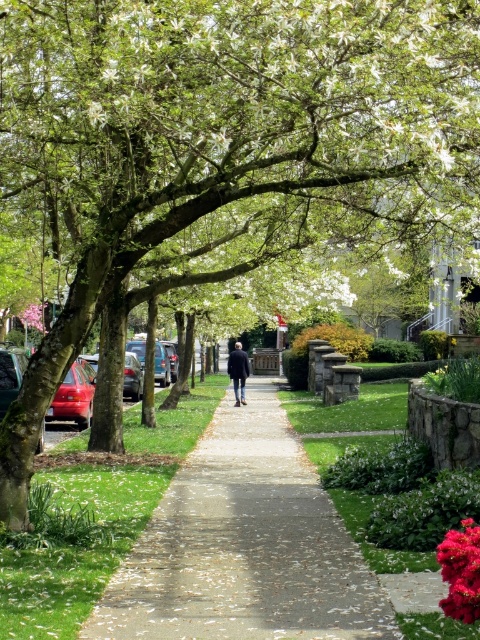
Is vivid crimson petals at center right above shiny red car at left?

No, vivid crimson petals at center right is not above shiny red car at left.

Which is above, vivid crimson petals at center right or shiny red car at left?

Positioned higher is shiny red car at left.

Between point (446, 534) and point (48, 413), which one is positioned in front?

Positioned in front is point (446, 534).

Locate an element on the screen. The width and height of the screenshot is (480, 640). vivid crimson petals at center right is located at coordinates (460, 572).

How much distance is there between concrete sidewalk at center and shiny red car at left?

concrete sidewalk at center is 3.54 meters from shiny red car at left.

Is concrete sidewalk at center shorter than shiny red car at left?

Correct, concrete sidewalk at center is not as tall as shiny red car at left.

Who is more distant from viewer, (279, 572) or (83, 369)?

Positioned behind is point (83, 369).

Locate an element on the screen. The width and height of the screenshot is (480, 640). concrete sidewalk at center is located at coordinates (243, 545).

Measure the distance between shiny red car at left and dark blue jacket at center.

shiny red car at left and dark blue jacket at center are 8.81 meters apart.

The image size is (480, 640). Describe the element at coordinates (74, 396) in the screenshot. I see `shiny red car at left` at that location.

Is point (60, 410) closer to camera compared to point (228, 358)?

Yes, point (60, 410) is in front of point (228, 358).

You are a GUI agent. You are given a task and a screenshot of the screen. Output one action in this format:
    pyautogui.click(x=<x>, y=<y>)
    Task: Click on the shiny red car at left
    Image resolution: width=480 pixels, height=640 pixels.
    Given the screenshot: What is the action you would take?
    pos(74,396)